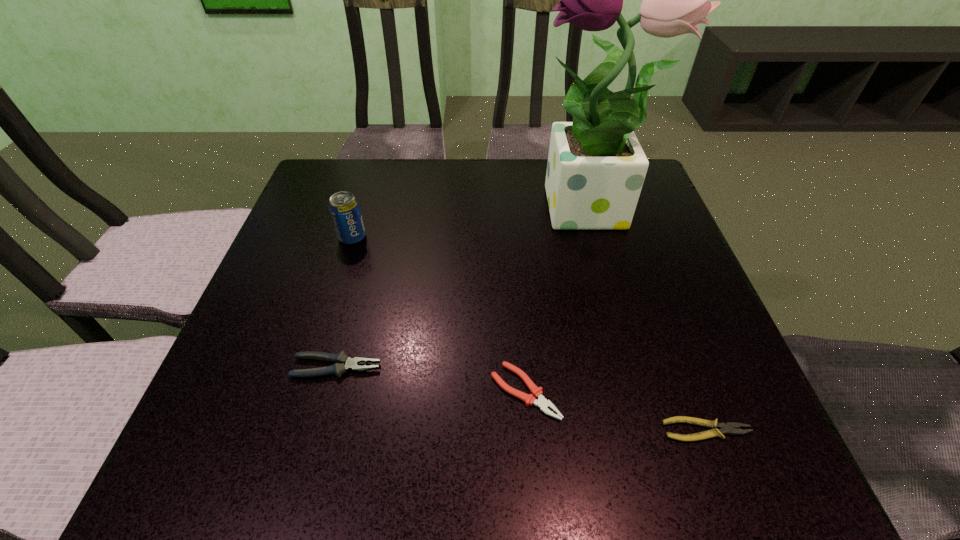
Identify the location of object at the far right corner. (596, 168).

Locate an element on the screen. This screenshot has height=540, width=960. object situated at the near right corner is located at coordinates (731, 427).

This screenshot has width=960, height=540. I want to click on vacant space at the far edge, so click(x=470, y=174).

You are a GUI agent. You are given a task and a screenshot of the screen. Output one action in this format:
    pyautogui.click(x=<x>, y=<y>)
    Task: Click on the free space at the near edge of the desktop
    Image resolution: width=960 pixels, height=540 pixels.
    Given the screenshot: What is the action you would take?
    (x=434, y=457)

The width and height of the screenshot is (960, 540). I want to click on vacant space at the left edge of the desktop, so click(x=305, y=266).

In the image, there is a desktop. In order to click on vacant space at the right edge in this screenshot , I will do point(697,342).

Where is `free point at the far left corner`? This screenshot has height=540, width=960. free point at the far left corner is located at coordinates (325, 164).

In the image, there is a desktop. Where is `vacant space at the far right corner`? vacant space at the far right corner is located at coordinates (648, 177).

At what (x,y) coordinates should I click in order to perform the action: click on vacant area that lies between the second shortest object and the shortest pliers. Please return your answer as a coordinate pair (x, y). This screenshot has height=540, width=960. Looking at the image, I should click on (616, 411).

This screenshot has height=540, width=960. Identify the location of blank region between the soda and the fourth tallest object. (439, 314).